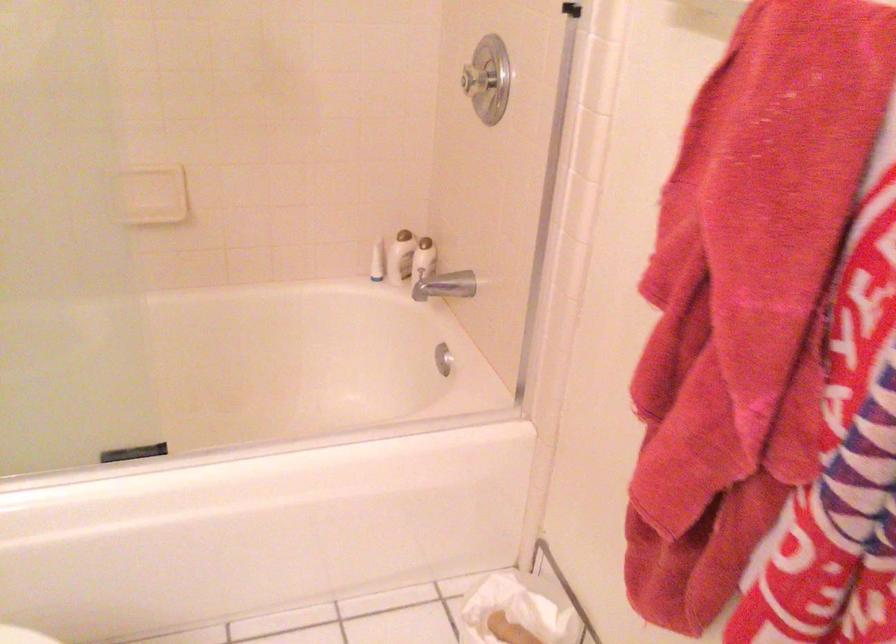
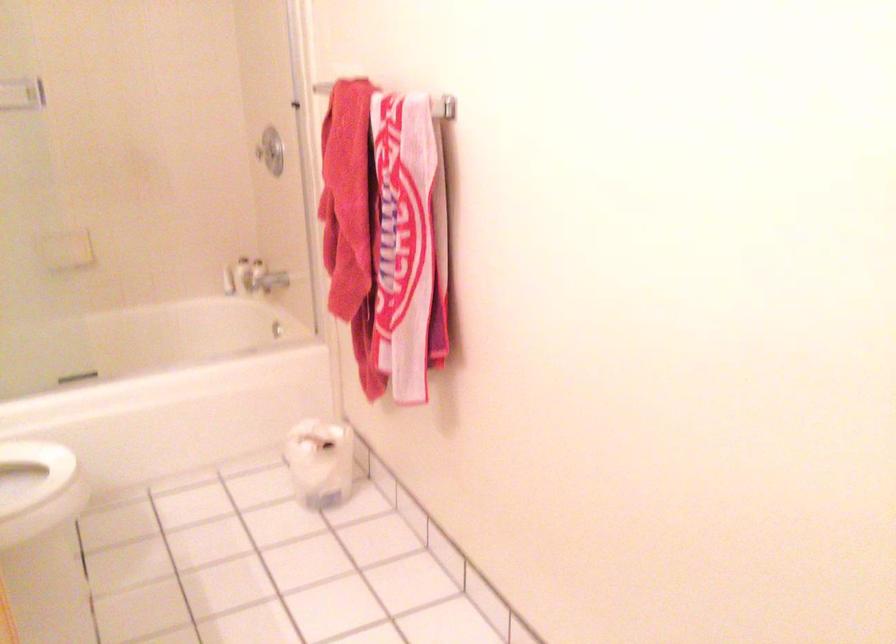
Question: In a continuous first-person perspective shot, in which direction is the camera moving?

Choices:
 (A) Left
 (B) Right
 (C) Forward
 (D) Backward

Answer: (D)